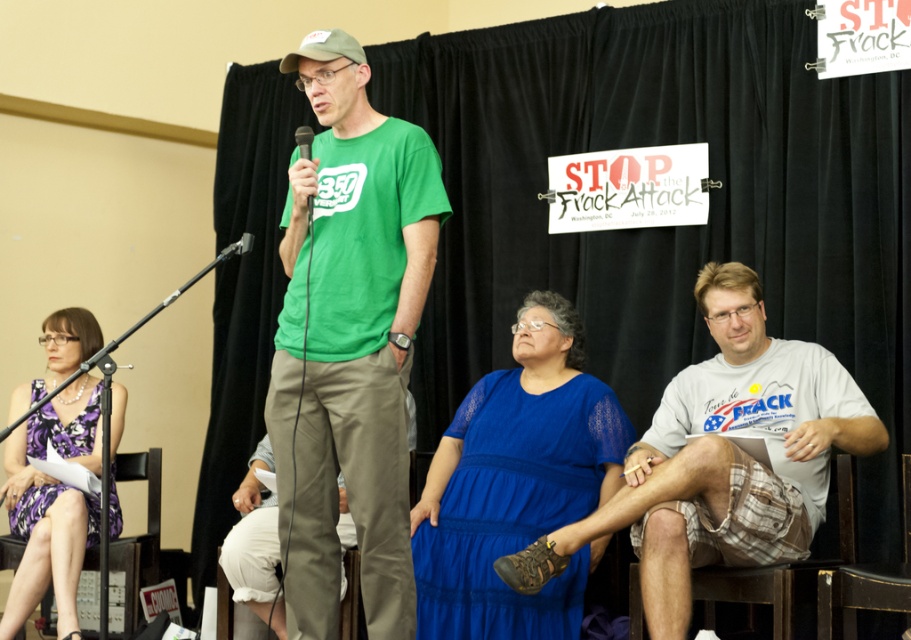
This screenshot has height=640, width=911. Find the location of `purple satin dress at lower left`. purple satin dress at lower left is located at coordinates (50, 506).

Does point (80, 540) come in front of point (776, 598)?

That is False.

The width and height of the screenshot is (911, 640). In order to click on purple satin dress at lower left in this screenshot , I will do `click(50, 506)`.

Is point (67, 509) less distant than point (294, 138)?

Yes.

Who is positioned more to the left, purple satin dress at lower left or matte green microphone at center?

Positioned to the left is purple satin dress at lower left.

Find the location of a particular element. purple satin dress at lower left is located at coordinates (50, 506).

From the picture: Between green matte t-shirt at center and matte green microphone at center, which one appears on the right side from the viewer's perspective?

green matte t-shirt at center is more to the right.

Does green matte t-shirt at center appear over matte green microphone at center?

Actually, green matte t-shirt at center is below matte green microphone at center.

At what (x,y) coordinates should I click in order to perform the action: click on green matte t-shirt at center. Please return your answer as a coordinate pair (x, y). Looking at the image, I should click on (350, 339).